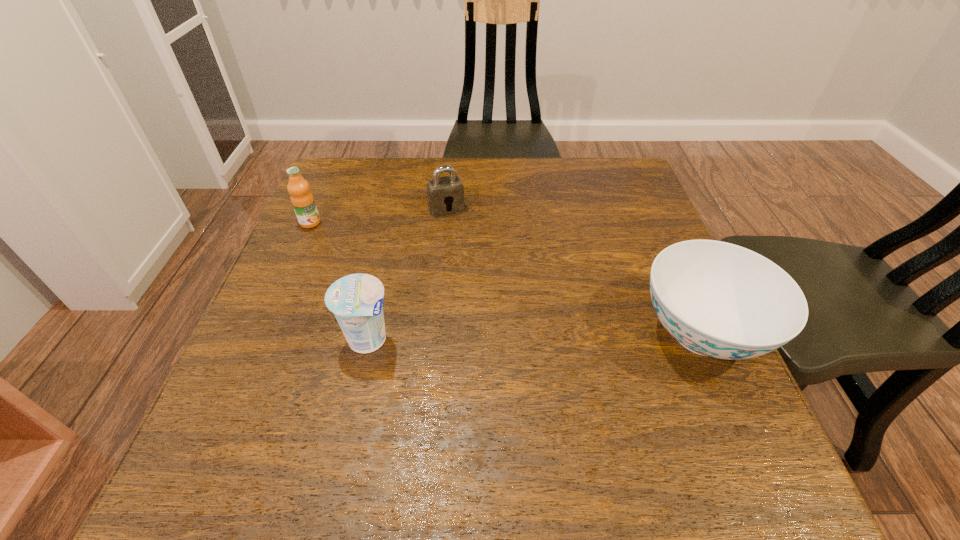
You are a GUI agent. You are given a task and a screenshot of the screen. Output one action in this format:
    pyautogui.click(x=<x>, y=<y>)
    Task: Click on the vacant space located at the front of the padlock near the keyhole
    
    Given the screenshot: What is the action you would take?
    (x=459, y=228)

Locate an element on the screen. This screenshot has height=540, width=960. vacant area located at the front of the padlock near the keyhole is located at coordinates (465, 240).

Where is `object located at the far edge`? object located at the far edge is located at coordinates (444, 194).

This screenshot has height=540, width=960. What are the coordinates of `object that is at the near edge` in the screenshot? It's located at (717, 299).

You are a GUI agent. You are given a task and a screenshot of the screen. Output one action in this format:
    pyautogui.click(x=<x>, y=<y>)
    Task: Click on the object present at the left edge
    
    Given the screenshot: What is the action you would take?
    pyautogui.click(x=302, y=199)

Locate an element on the screen. This screenshot has height=540, width=960. object that is at the right edge is located at coordinates (717, 299).

This screenshot has width=960, height=540. Identify the location of object positioned at the near right corner. (717, 299).

Locate an element on the screen. vacant space at the far edge of the desktop is located at coordinates (376, 188).

What are the coordinates of `vacant space at the left edge of the desktop` in the screenshot? It's located at (329, 275).

In the image, there is a desktop. At what (x,y) coordinates should I click in order to perform the action: click on free region at the right edge. Please return your answer as a coordinate pair (x, y). The width and height of the screenshot is (960, 540). Looking at the image, I should click on (645, 232).